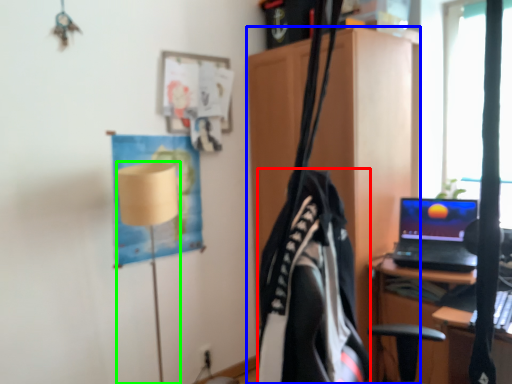
Question: Which object is the farthest from clothing (highlighted by a red box)? Choose among these: cabinetry (highlighted by a blue box) or table lamp (highlighted by a green box).

Choices:
 (A) cabinetry
 (B) table lamp

Answer: (A)